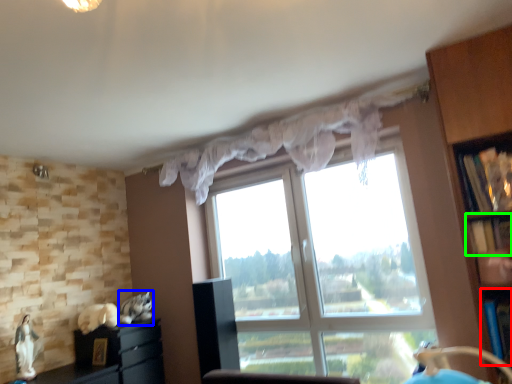
Question: Which object is the farthest from shelf (highlighted by a red box)? Choose among these: animal (highlighted by a blue box) or shelf (highlighted by a green box).

Choices:
 (A) animal
 (B) shelf

Answer: (A)